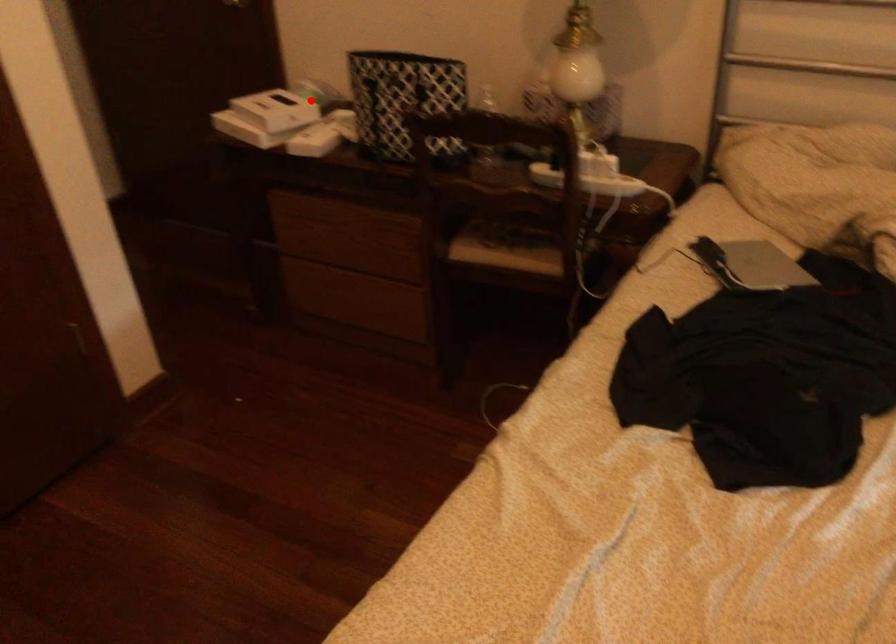
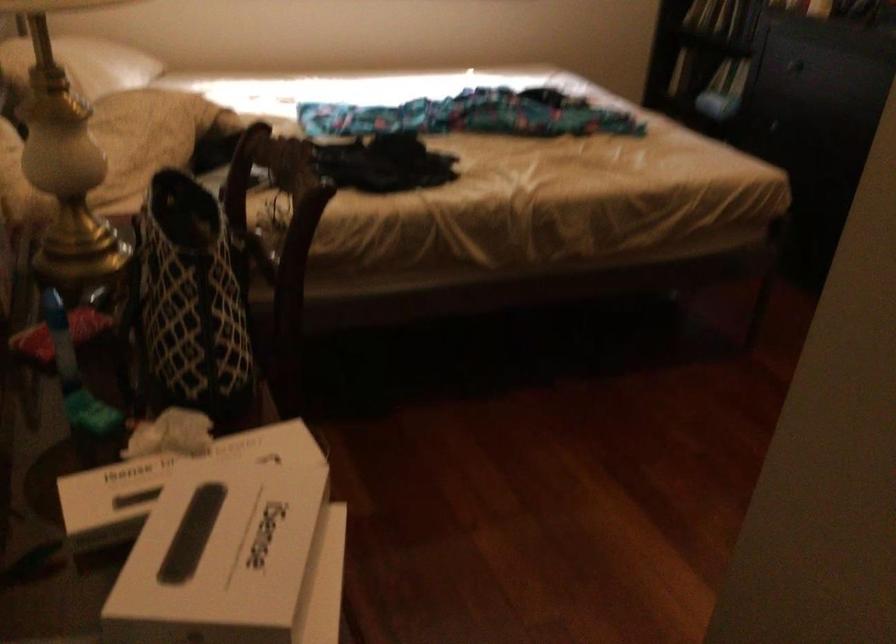
Find the pixel in the second image that matches the highlighted location in the first image.

(168, 477)